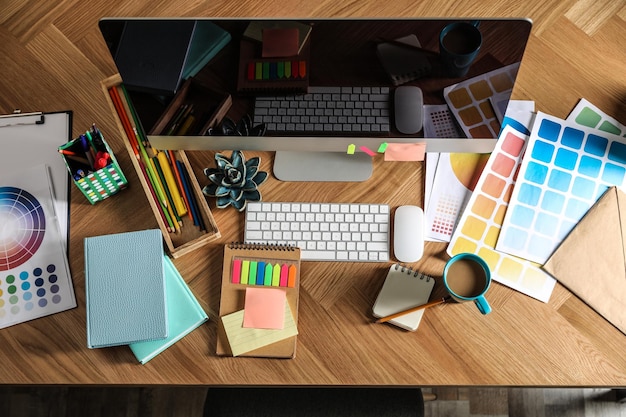
Locate an element on the screen. The height and width of the screenshot is (417, 626). notepads is located at coordinates (392, 298), (230, 289), (149, 287), (178, 302).